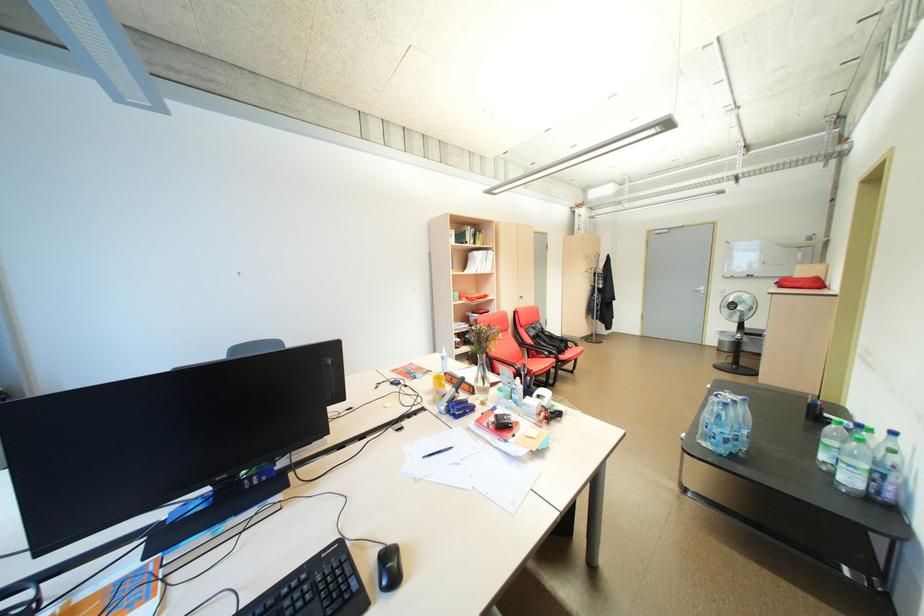
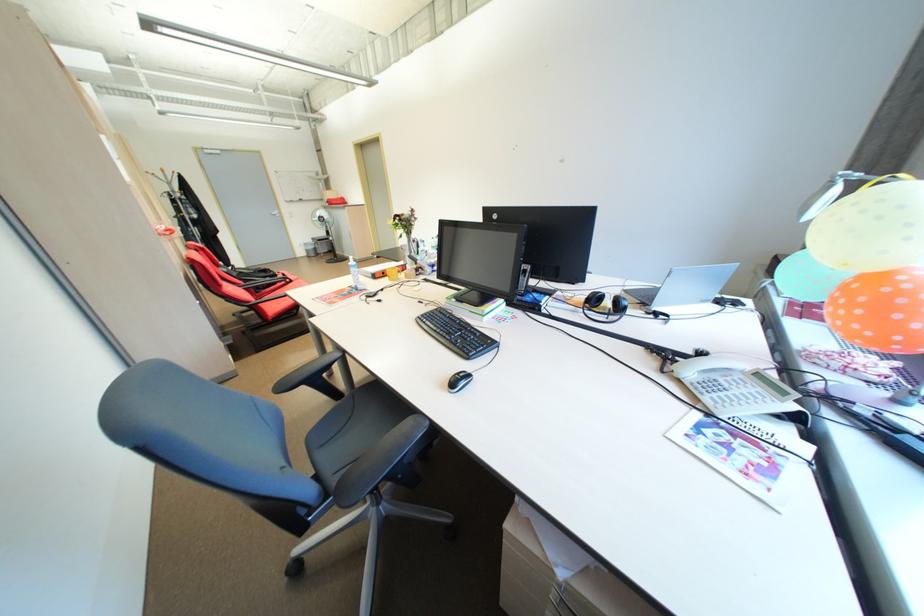
In the second image, find the point that corresponds to (728,342) in the first image.

(315, 252)